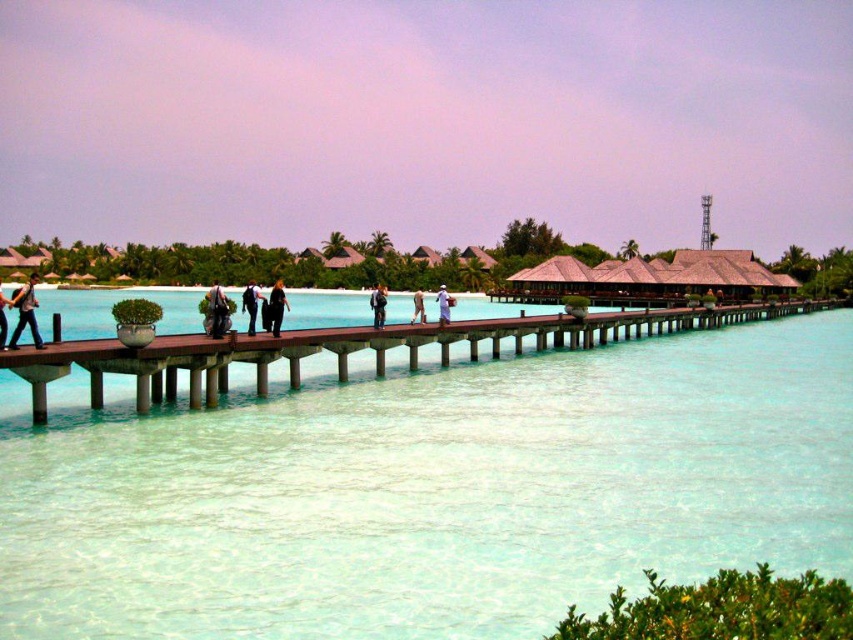
Which of these two, dark blue fabric bag at center or dark blue jeans at center, stands shorter?

With less height is dark blue jeans at center.

Can you confirm if dark blue fabric bag at center is taller than dark blue jeans at center?

Indeed, dark blue fabric bag at center has a greater height compared to dark blue jeans at center.

At what (x,y) coordinates should I click in order to perform the action: click on dark blue fabric bag at center. Please return your answer as a coordinate pair (x, y). Looking at the image, I should click on (216, 310).

Does matte black pants at left have a smaller size compared to dark blue jeans at center?

Incorrect, matte black pants at left is not smaller in size than dark blue jeans at center.

Describe the element at coordinates (25, 312) in the screenshot. The image size is (853, 640). I see `matte black pants at left` at that location.

You are a GUI agent. You are given a task and a screenshot of the screen. Output one action in this format:
    pyautogui.click(x=<x>, y=<y>)
    Task: Click on the matte black pants at left
    
    Given the screenshot: What is the action you would take?
    pyautogui.click(x=25, y=312)

Which is in front, point (206, 305) or point (277, 324)?

Point (206, 305) is more forward.

Is dark blue fabric bag at center below black matte dress at center?

Correct, dark blue fabric bag at center is located below black matte dress at center.

You are a GUI agent. You are given a task and a screenshot of the screen. Output one action in this format:
    pyautogui.click(x=<x>, y=<y>)
    Task: Click on the dark blue fabric bag at center
    
    Given the screenshot: What is the action you would take?
    pyautogui.click(x=216, y=310)